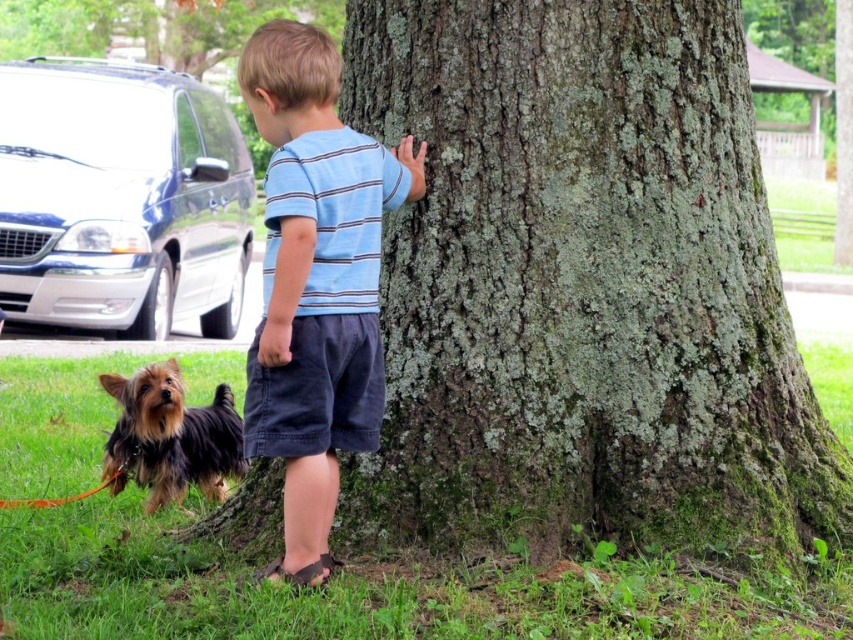
Which is behind, point (247, 28) or point (143, 388)?

Positioned behind is point (247, 28).

Is green mossy tree trunk at center shorter than shaggy brown fur at lower left?

In fact, green mossy tree trunk at center may be taller than shaggy brown fur at lower left.

Identify the location of green mossy tree trunk at center. The width and height of the screenshot is (853, 640). (149, 26).

The image size is (853, 640). Identify the location of green mossy tree trunk at center. (149, 26).

Can you confirm if blue striped shirt at center is thinner than green mossy tree trunk at center?

Yes.

Who is higher up, blue striped shirt at center or green mossy tree trunk at center?

green mossy tree trunk at center is above.

This screenshot has height=640, width=853. What are the coordinates of `blue striped shirt at center` in the screenshot? It's located at (316, 282).

Does green mossy bark at center appear on the left side of green mossy tree trunk at center?

No, green mossy bark at center is not to the left of green mossy tree trunk at center.

Where is `green mossy bark at center`? green mossy bark at center is located at coordinates 579,285.